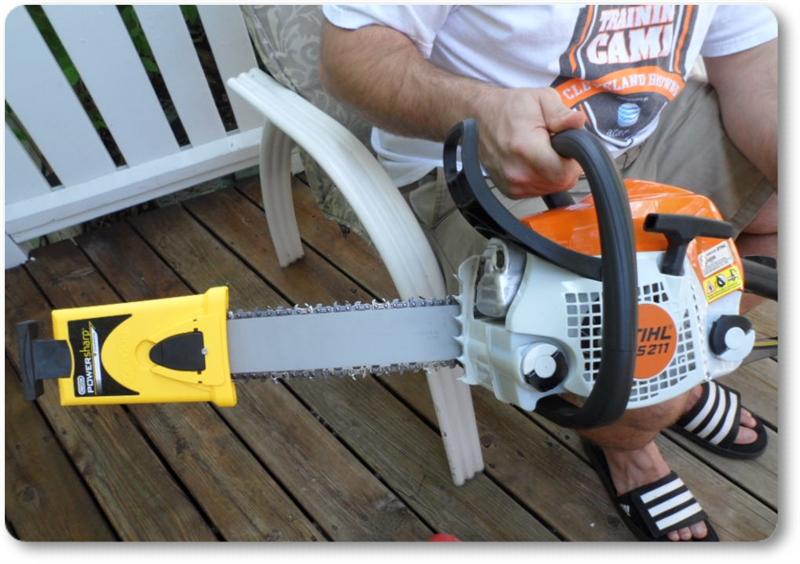
Identify the location of chair. (338, 174).